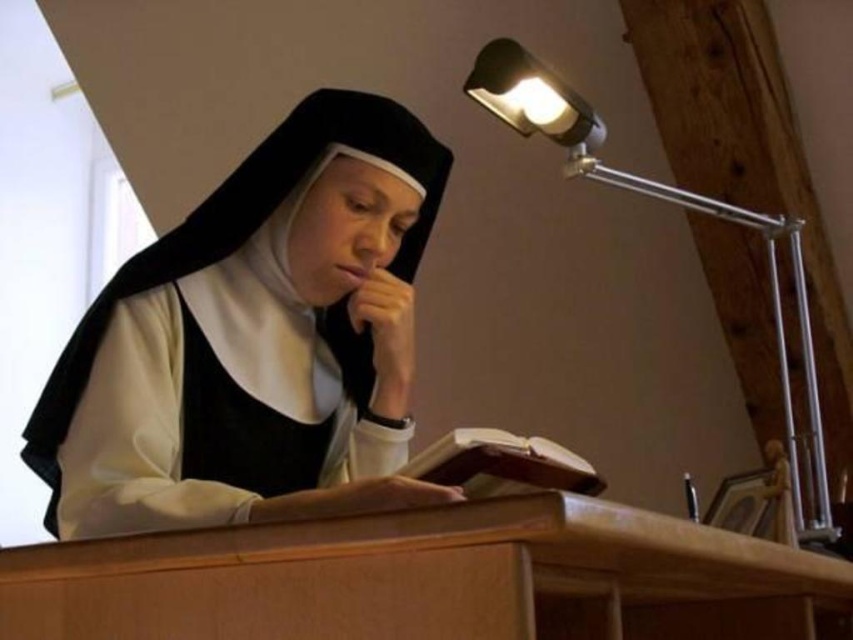
Question: Can you confirm if light brown wooden table at center is wider than metallic silver desk lamp at upper right?

Choices:
 (A) no
 (B) yes

Answer: (B)

Question: Does matte black habit at center have a larger size compared to light brown wooden table at center?

Choices:
 (A) yes
 (B) no

Answer: (A)

Question: Which is farther from the matte black habit at center?

Choices:
 (A) brown leather book at center
 (B) metallic silver desk lamp at upper right

Answer: (B)

Question: Which of the following is the closest to the observer?

Choices:
 (A) metallic silver desk lamp at upper right
 (B) light brown wooden table at center
 (C) matte black habit at center
 (D) brown leather book at center

Answer: (B)

Question: Is light brown wooden table at center wider than metallic silver desk lamp at upper right?

Choices:
 (A) yes
 (B) no

Answer: (A)

Question: Which object is positioned farthest from the light brown wooden table at center?

Choices:
 (A) matte black habit at center
 (B) brown leather book at center

Answer: (A)